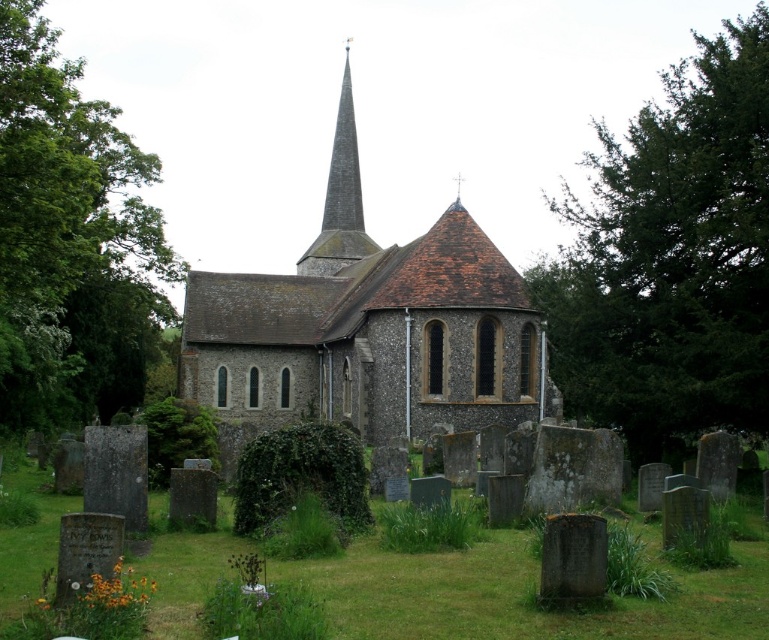
You are standing in the churchyard and want to take a photo of the gray stone steeple at upper center without the green leafy tree at center blocking the view. Which direction should you move to ensure the tree is out of frame?

Move to the left or right side of the green leafy tree at center so that the gray stone steeple at upper center is visible without obstruction. Since the green leafy tree at center is bigger than the gray stone steeple at upper center, moving to either side would help avoid the tree blocking the view.

You are standing in the churchyard and want to take a photo of the gray stone steeple at upper center without the green leafy tree at center blocking it. What should you do?

The green leafy tree at center might be wider than the gray stone steeple at upper center, so you should move to the side so that the tree is not in front of the steeple.

From the picture: You are standing in the churchyard and want to take a photo of both the green leafy tree at center and the brown stone spire at center. Which object should you position closer to the camera to ensure both are in focus?

The green leafy tree at center is much taller than the brown stone spire at center, so you should position the camera closer to the brown stone spire at center to ensure both are in focus.